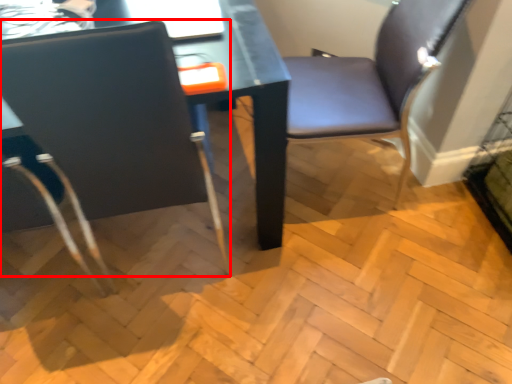
Question: From the image's perspective, considering the relative positions of chair (annotated by the red box) and chair in the image provided, where is chair (annotated by the red box) located with respect to the staircase?

Choices:
 (A) below
 (B) above

Answer: (A)